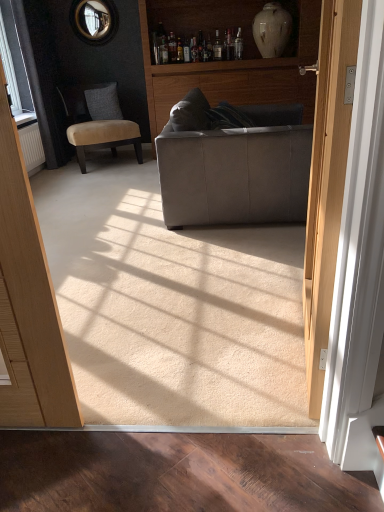
Question: Does suede gray couch at center have a lesser width compared to suede-like gray pillow at left?

Choices:
 (A) yes
 (B) no

Answer: (B)

Question: Considering the relative sizes of suede gray couch at center and suede-like gray pillow at left in the image provided, is suede gray couch at center taller than suede-like gray pillow at left?

Choices:
 (A) yes
 (B) no

Answer: (A)

Question: Is suede gray couch at center aimed at suede-like gray pillow at left?

Choices:
 (A) yes
 (B) no

Answer: (B)

Question: Are suede gray couch at center and suede-like gray pillow at left located far from each other?

Choices:
 (A) yes
 (B) no

Answer: (A)

Question: From a real-world perspective, is suede gray couch at center over suede-like gray pillow at left?

Choices:
 (A) yes
 (B) no

Answer: (B)

Question: Are suede gray couch at center and suede-like gray pillow at left making contact?

Choices:
 (A) yes
 (B) no

Answer: (B)

Question: From a real-world perspective, is matte gray couch at center under white glossy vase at upper center?

Choices:
 (A) no
 (B) yes

Answer: (B)

Question: Is matte gray couch at center looking in the opposite direction of white glossy vase at upper center?

Choices:
 (A) no
 (B) yes

Answer: (B)

Question: Would you say matte gray couch at center contains white glossy vase at upper center?

Choices:
 (A) yes
 (B) no

Answer: (A)

Question: From a real-world perspective, is matte gray couch at center located higher than white glossy vase at upper center?

Choices:
 (A) no
 (B) yes

Answer: (A)

Question: Is matte gray couch at center not near white glossy vase at upper center?

Choices:
 (A) no
 (B) yes

Answer: (A)

Question: Could you tell me if matte gray couch at center is facing white glossy vase at upper center?

Choices:
 (A) no
 (B) yes

Answer: (B)

Question: Is white glossy vase at upper center not close to velvet beige chair at left?

Choices:
 (A) yes
 (B) no

Answer: (A)